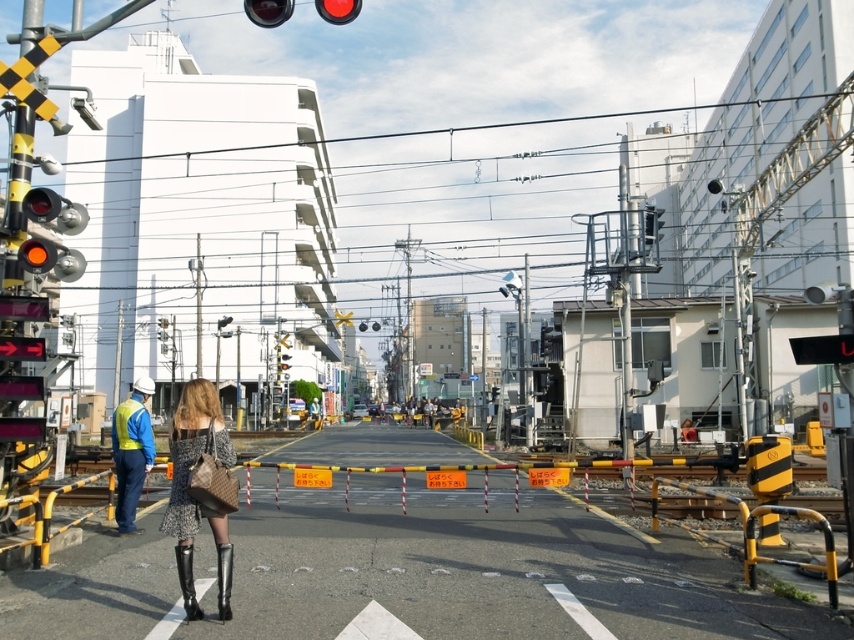
Does point (30, 262) come in front of point (268, 24)?

Yes, point (30, 262) is closer to viewer.

Which is below, matte orange traffic light at left or matte glass traffic light at upper center?

matte orange traffic light at left is below.

Locate an element on the screen. This screenshot has height=640, width=854. matte orange traffic light at left is located at coordinates (54, 211).

Between leather high-heeled boot at lower left and red glass traffic light at upper center, which one is positioned higher?

Positioned higher is red glass traffic light at upper center.

Can you confirm if leather high-heeled boot at lower left is taller than red glass traffic light at upper center?

In fact, leather high-heeled boot at lower left may be shorter than red glass traffic light at upper center.

What do you see at coordinates (186, 580) in the screenshot? I see `leather high-heeled boot at lower left` at bounding box center [186, 580].

In order to click on leather high-heeled boot at lower left in this screenshot , I will do `click(186, 580)`.

Does knit fabric dress at center have a larger size compared to leather high-heeled boot at lower left?

Yes, knit fabric dress at center is bigger than leather high-heeled boot at lower left.

In the scene shown: Between knit fabric dress at center and leather high-heeled boot at lower left, which one appears on the right side from the viewer's perspective?

leather high-heeled boot at lower left is more to the right.

Between point (190, 531) and point (189, 586), which one is positioned in front?

Positioned in front is point (189, 586).

What are the coordinates of `knit fabric dress at center` in the screenshot? It's located at (192, 499).